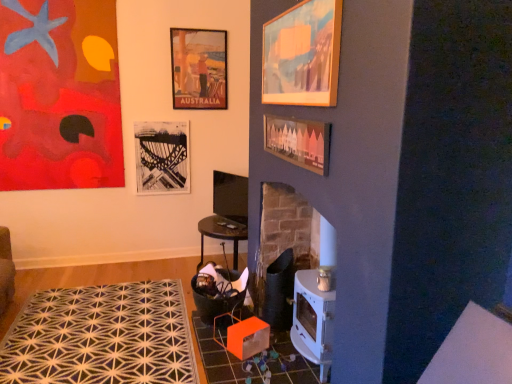
Question: From their relative heights in the image, would you say black paper picture frame at upper center, which is the 5th picture frame from front to back, is taller or shorter than orange fabric rocking chair at lower left?

Choices:
 (A) tall
 (B) short

Answer: (A)

Question: Relative to orange fabric rocking chair at lower left, is black paper picture frame at upper center, the 1th picture frame when ordered from back to front, in front or behind?

Choices:
 (A) front
 (B) behind

Answer: (B)

Question: Which object is the closest to the abstract painting at upper left, the third picture frame positioned from the front?

Choices:
 (A) wooden picture frame at upper center, positioned as the fifth picture frame in left-to-right order
 (B) matte paper poster at upper center, acting as the third picture frame starting from the right
 (C) black paper picture frame at upper center, which is counted as the 2th picture frame, starting from the left
 (D) wooden picture frame at center, acting as the 4th picture frame starting from the left
 (E) orange fabric rocking chair at lower left

Answer: (C)

Question: Based on their relative distances, which object is nearer to the matte paper poster at upper center, which ranks as the 2th picture frame in back-to-front order?

Choices:
 (A) wooden picture frame at center, positioned as the second picture frame in front-to-back order
 (B) white geometric rug at lower left
 (C) wooden picture frame at upper center, which is the first picture frame in front-to-back order
 (D) abstract painting at upper left, the 1th picture frame from the left
 (E) orange fabric rocking chair at lower left

Answer: (D)